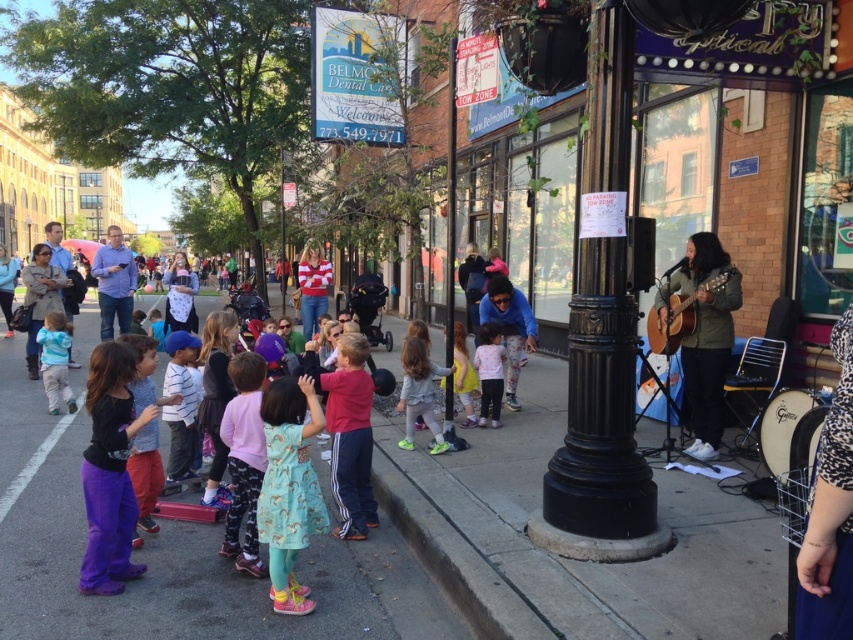
Question: Which point is closer to the camera?

Choices:
 (A) (442, 438)
 (B) (86, 547)
 (C) (172, 344)

Answer: (B)

Question: Is teal printed dress at center bigger than light pink fabric dress at center?

Choices:
 (A) no
 (B) yes

Answer: (A)

Question: Does teal printed dress at center have a lesser width compared to acoustic guitar at right?

Choices:
 (A) yes
 (B) no

Answer: (A)

Question: Among these objects, which one is farthest from the camera?

Choices:
 (A) pink fabric dress at center
 (B) blue fabric pants at lower center
 (C) green matte jacket at right
 (D) purple cotton pants at lower left

Answer: (B)

Question: Which point is farther to the camera?

Choices:
 (A) yellow fabric dress at center
 (B) light pink fabric dress at center
 (C) light blue fabric jacket at lower left
 (D) floral dress at center

Answer: (C)

Question: Can you confirm if teal printed dress at center is wider than light pink fabric dress at center?

Choices:
 (A) no
 (B) yes

Answer: (A)